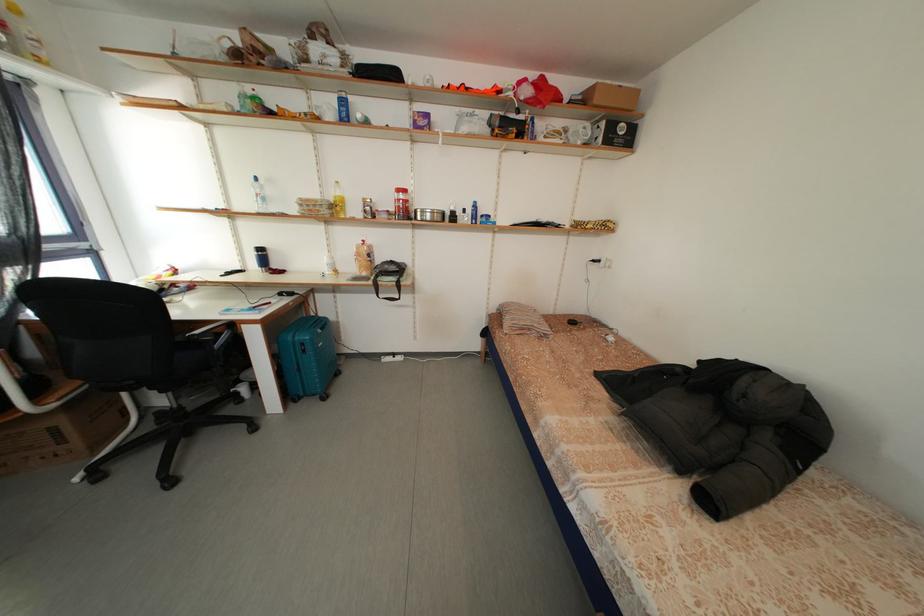
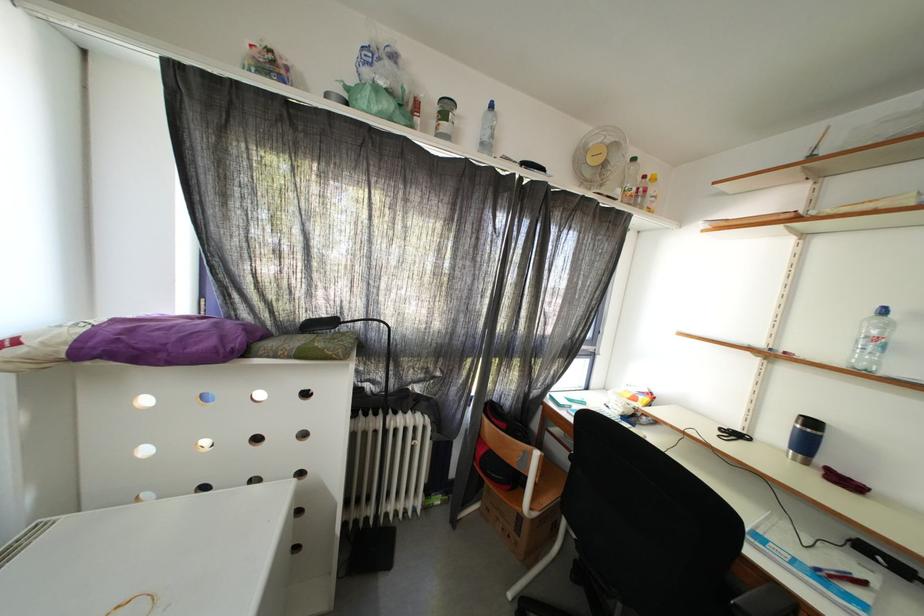
Find the pixel in the second image that matches (x=269, y=254) in the first image.

(820, 429)